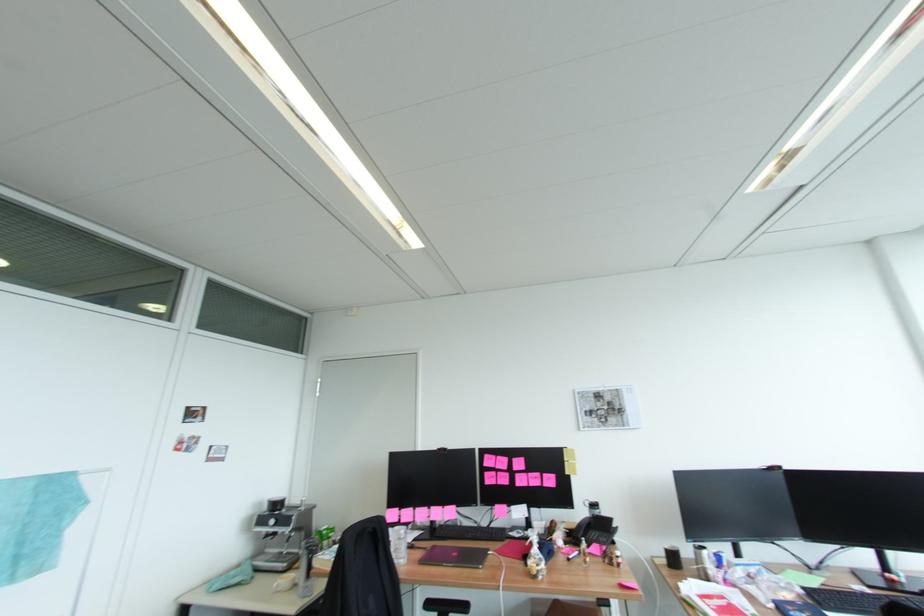
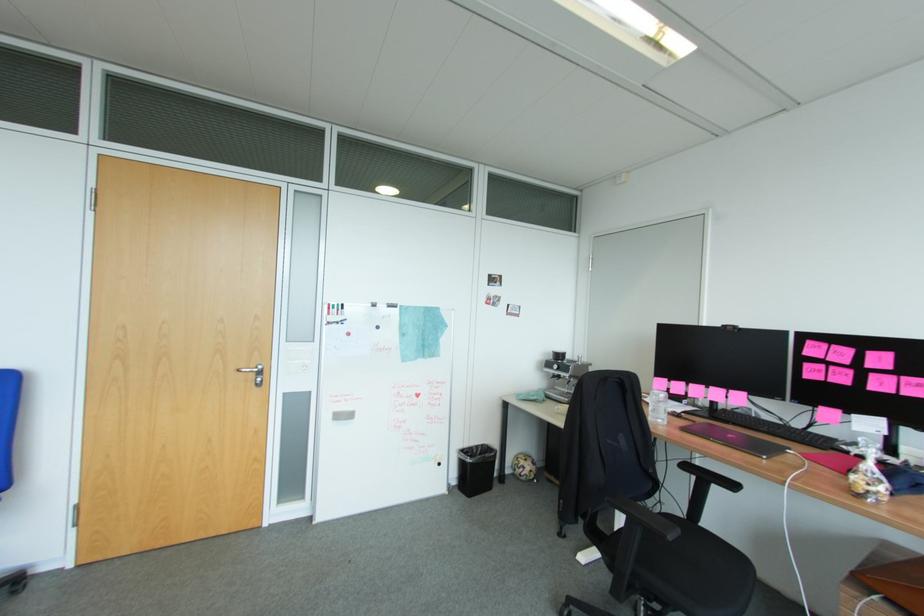
Question: The camera is either moving clockwise (left) or counter-clockwise (right) around the object. The first image is from the beginning of the video and the second image is from the end. Is the camera moving left or right when shooting the video?

Choices:
 (A) Left
 (B) Right

Answer: (B)